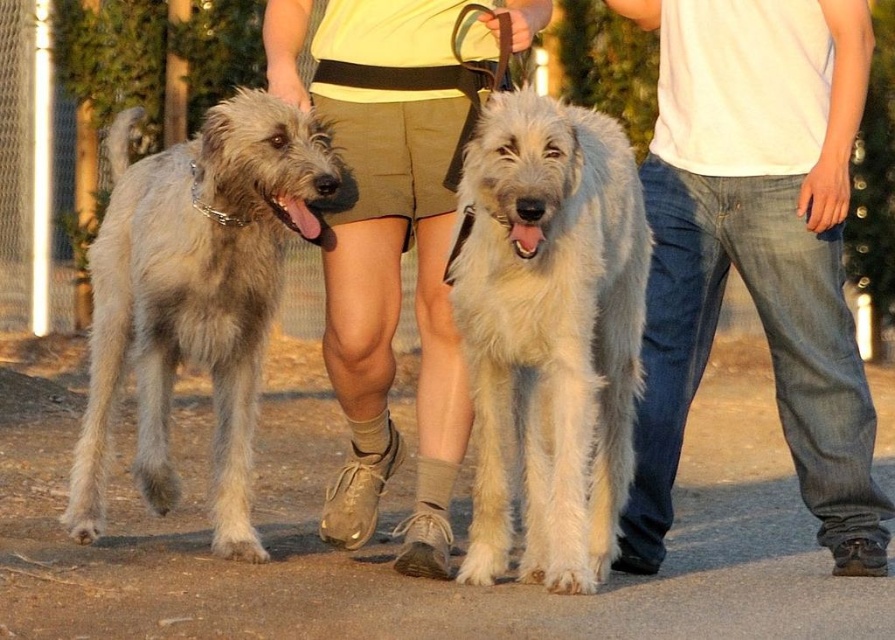
Question: Based on their relative distances, which object is nearer to the light gray fur at left?

Choices:
 (A) light beige shorts at center
 (B) silvery fur dog at center
 (C) light gray fur at center

Answer: (A)

Question: Which object is positioned closest to the silvery fur dog at center?

Choices:
 (A) light gray fur at center
 (B) light beige shorts at center
 (C) light gray fur at left

Answer: (A)

Question: Is silvery fur dog at center to the left of light beige shorts at center from the viewer's perspective?

Choices:
 (A) no
 (B) yes

Answer: (A)

Question: Which point is closer to the camera?

Choices:
 (A) light beige shorts at center
 (B) denim jeans at right
 (C) light gray fur at left
 (D) silvery fur dog at center

Answer: (C)

Question: Does light gray fur at center appear over light beige shorts at center?

Choices:
 (A) no
 (B) yes

Answer: (A)

Question: Is silvery fur dog at center in front of denim jeans at right?

Choices:
 (A) yes
 (B) no

Answer: (B)